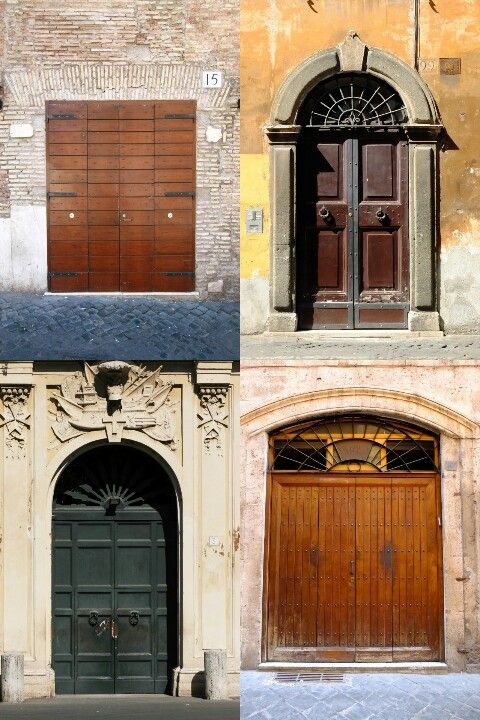
Where is `door handles`? The height and width of the screenshot is (720, 480). door handles is located at coordinates (124, 219), (93, 618), (133, 620), (352, 569), (380, 214), (325, 212).